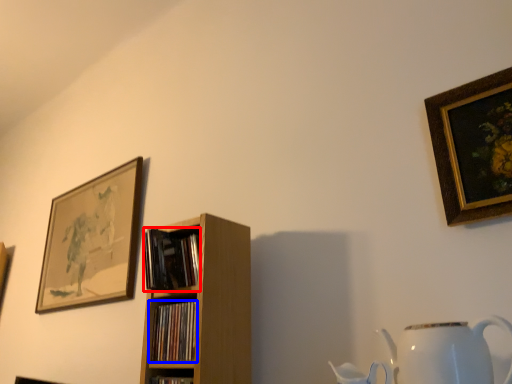
Question: Which of the following is the closest to the observer, book (highlighted by a red box) or book (highlighted by a blue box)?

Choices:
 (A) book
 (B) book

Answer: (B)